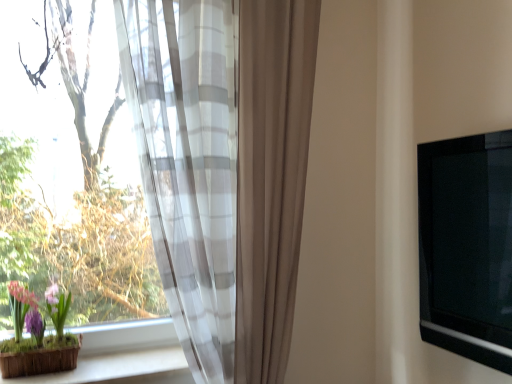
Question: Does wooden at lower left lie in front of transparent fabric at left?

Choices:
 (A) no
 (B) yes

Answer: (A)

Question: From a real-world perspective, does wooden at lower left stand above transparent fabric at left?

Choices:
 (A) yes
 (B) no

Answer: (B)

Question: Considering the relative sizes of wooden at lower left and transparent fabric at left in the image provided, is wooden at lower left wider than transparent fabric at left?

Choices:
 (A) no
 (B) yes

Answer: (A)

Question: Can you confirm if wooden at lower left is positioned to the right of transparent fabric at left?

Choices:
 (A) no
 (B) yes

Answer: (B)

Question: Is wooden at lower left outside of transparent fabric at left?

Choices:
 (A) yes
 (B) no

Answer: (B)

Question: Looking at the image, does transparent fabric at left seem bigger or smaller compared to sheer white and gray striped curtain at left?

Choices:
 (A) small
 (B) big

Answer: (A)

Question: Looking at their shapes, would you say transparent fabric at left is wider or thinner than sheer white and gray striped curtain at left?

Choices:
 (A) thin
 (B) wide

Answer: (B)

Question: From a real-world perspective, relative to sheer white and gray striped curtain at left, is transparent fabric at left vertically above or below?

Choices:
 (A) below
 (B) above

Answer: (B)

Question: Does point (50, 211) appear closer or farther from the camera than point (139, 92)?

Choices:
 (A) closer
 (B) farther

Answer: (B)

Question: Considering the positions of point (480, 344) and point (104, 360), is point (480, 344) closer or farther from the camera than point (104, 360)?

Choices:
 (A) farther
 (B) closer

Answer: (B)

Question: Considering their positions, is black glossy tv at right located in front of or behind wooden at lower left?

Choices:
 (A) behind
 (B) front

Answer: (B)

Question: Considering the positions of black glossy tv at right and wooden at lower left in the image, is black glossy tv at right taller or shorter than wooden at lower left?

Choices:
 (A) short
 (B) tall

Answer: (B)

Question: Looking at the image, does black glossy tv at right seem bigger or smaller compared to wooden at lower left?

Choices:
 (A) small
 (B) big

Answer: (B)

Question: Considering their positions, is matte brown pot at lower left located in front of or behind sheer white and gray striped curtain at left?

Choices:
 (A) behind
 (B) front

Answer: (A)

Question: In the image, is matte brown pot at lower left on the left side or the right side of sheer white and gray striped curtain at left?

Choices:
 (A) left
 (B) right

Answer: (A)